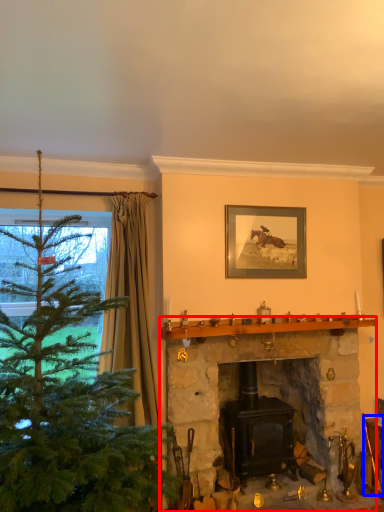
Question: Which of the following is the farthest to the observer, fireplace (highlighted by a red box) or furniture (highlighted by a blue box)?

Choices:
 (A) fireplace
 (B) furniture

Answer: (B)